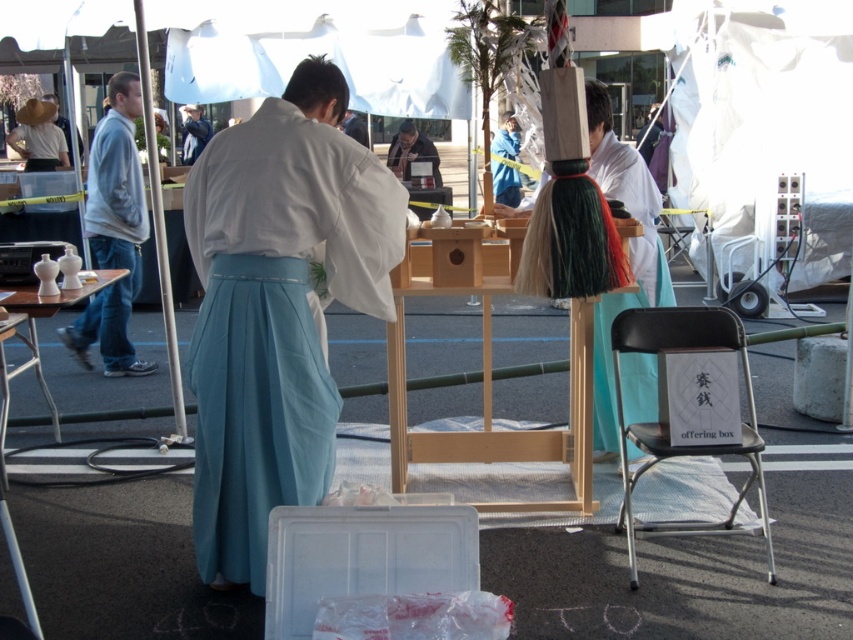
Question: Does blue silk robe at center have a larger size compared to light blue silk robe at center?

Choices:
 (A) yes
 (B) no

Answer: (A)

Question: Which object is the farthest from the teal satin skirt at center?

Choices:
 (A) white silk kimono at center
 (B) light blue silk kimono at center

Answer: (A)

Question: Is white silk kimono at center wider than black plastic chair at lower right?

Choices:
 (A) no
 (B) yes

Answer: (A)

Question: Does teal satin skirt at center appear over white silk kimono at center?

Choices:
 (A) no
 (B) yes

Answer: (A)

Question: Estimate the real-world distances between objects in this image. Which object is farther from the light blue silk kimono at center?

Choices:
 (A) white silk kimono at center
 (B) light blue silk robe at center

Answer: (B)

Question: Which of the following is the closest to the observer?

Choices:
 (A) (759, 500)
 (B) (209, 125)
 (C) (328, 472)
 (D) (633, 237)

Answer: (C)